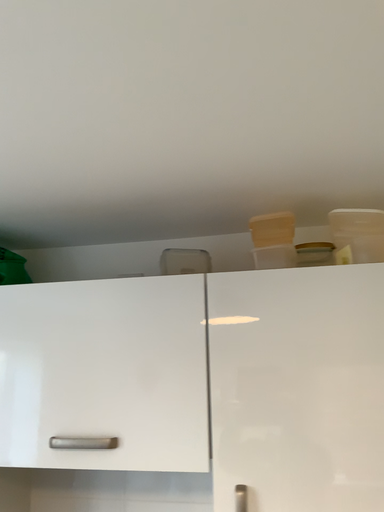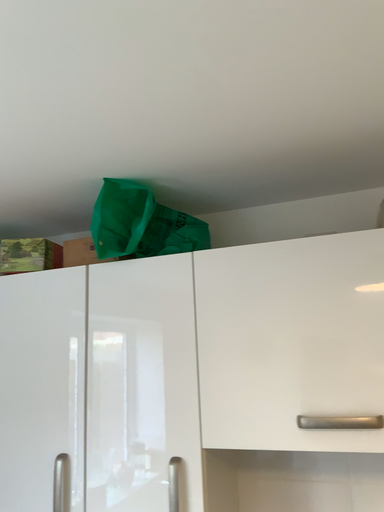
Question: How did the camera likely rotate when shooting the video?

Choices:
 (A) rotated right
 (B) rotated left

Answer: (B)